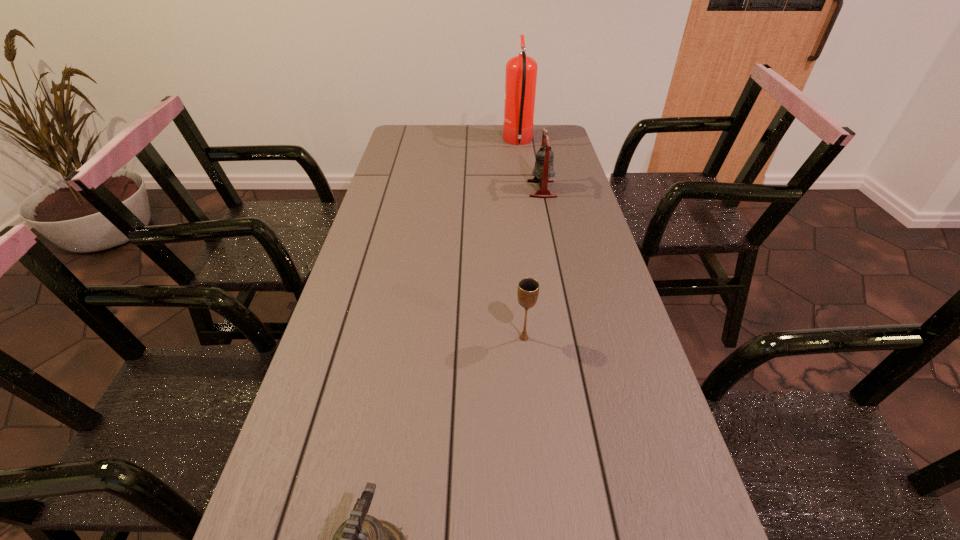
Image resolution: width=960 pixels, height=540 pixels. Find the location of `vacant area that lies between the third farthest object and the right bell`. vacant area that lies between the third farthest object and the right bell is located at coordinates (533, 264).

I want to click on vacant space that's between the farther bell and the second nearest object, so click(533, 264).

The width and height of the screenshot is (960, 540). I want to click on free space between the tallest object and the chalice, so click(x=521, y=240).

This screenshot has width=960, height=540. In order to click on empty location between the third farthest object and the farther bell in this screenshot , I will do `click(533, 264)`.

Locate an element on the screen. vacant area that lies between the fire extinguisher and the right bell is located at coordinates (530, 166).

Image resolution: width=960 pixels, height=540 pixels. In order to click on free area in between the third farthest object and the farthest object in this screenshot , I will do `click(521, 240)`.

What are the coordinates of `free space between the farthest object and the right bell` in the screenshot? It's located at (530, 166).

At what (x,y) coordinates should I click in order to perform the action: click on object that is the second closest to the leftmost object. Please return your answer as a coordinate pair (x, y). The width and height of the screenshot is (960, 540). Looking at the image, I should click on tap(543, 170).

Locate which object ranks third in proximity to the nearer bell. Please provide its 2D coordinates. Your answer should be formatted as a tuple, i.e. [(x, y)], where the tuple contains the x and y coordinates of a point satisfying the conditions above.

[(521, 71)]

The width and height of the screenshot is (960, 540). I want to click on vacant space that satisfies the following two spatial constraints: 1. towards the nozzle of the farther bell; 2. on the right side of the tallest object, so click(525, 189).